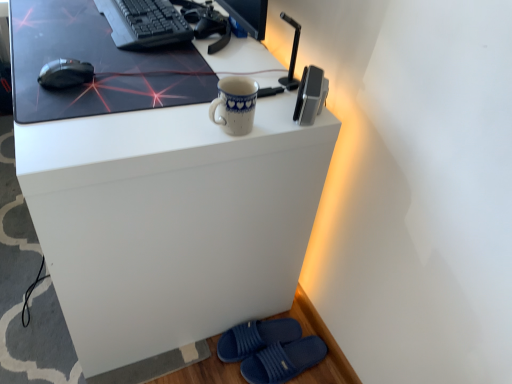
Identify the location of blue fabric slippers at lower right, which ranks as the 1th footwear in top-to-bottom order. The image size is (512, 384). (256, 337).

How much space does blue fabric slippers at lower right, which ranks as the 1th footwear in top-to-bottom order, occupy horizontally?

blue fabric slippers at lower right, which ranks as the 1th footwear in top-to-bottom order, is 12.31 inches in width.

What are the coordinates of `black matte keyboard at upper left` in the screenshot? It's located at (144, 23).

What is the approximate height of black matte mouse at left?

black matte mouse at left is 1.76 inches in height.

Describe the element at coordinates (95, 65) in the screenshot. The image size is (512, 384). I see `matte black mousepad at upper center` at that location.

This screenshot has width=512, height=384. Find the location of `satin silver speaker at upper right`. satin silver speaker at upper right is located at coordinates (310, 95).

From a real-world perspective, is blue porcelain mug at upper center physically above blue rubber slippers at lower right, which is the 1th footwear in bottom-to-top order?

Indeed, from a real-world perspective, blue porcelain mug at upper center stands above blue rubber slippers at lower right, which is the 1th footwear in bottom-to-top order.

This screenshot has width=512, height=384. Find the location of `mug located above the blue rubber slippers at lower right, marked as the second footwear in a top-to-bottom arrangement (from the image's perspective)`. mug located above the blue rubber slippers at lower right, marked as the second footwear in a top-to-bottom arrangement (from the image's perspective) is located at coordinates (234, 105).

Is blue porcelain mug at upper center positioned beyond the bounds of blue rubber slippers at lower right, which is the 1th footwear in bottom-to-top order?

Yes, blue porcelain mug at upper center is located beyond the bounds of blue rubber slippers at lower right, which is the 1th footwear in bottom-to-top order.

Is blue porcelain mug at upper center wider than blue rubber slippers at lower right, marked as the second footwear in a top-to-bottom arrangement?

No.

From the image's perspective, between blue rubber slippers at lower right, which is the 1th footwear in bottom-to-top order, and white glossy desk at center, which one is located above?

white glossy desk at center.

Is white glossy desk at center completely or partially inside blue rubber slippers at lower right, which is the 1th footwear in bottom-to-top order?

Actually, white glossy desk at center is outside blue rubber slippers at lower right, which is the 1th footwear in bottom-to-top order.

From a real-world perspective, is blue rubber slippers at lower right, which is the 1th footwear in bottom-to-top order, over white glossy desk at center?

No, from a real-world perspective, blue rubber slippers at lower right, which is the 1th footwear in bottom-to-top order, is not on top of white glossy desk at center.

From the image's perspective, is satin silver speaker at upper right below black matte mouse at left?

Indeed, from the image's perspective, satin silver speaker at upper right is shown beneath black matte mouse at left.

Measure the distance between satin silver speaker at upper right and black matte mouse at left.

satin silver speaker at upper right is 49.60 centimeters away from black matte mouse at left.

In terms of width, does satin silver speaker at upper right look wider or thinner when compared to black matte mouse at left?

Clearly, satin silver speaker at upper right has less width compared to black matte mouse at left.

Is satin silver speaker at upper right taller than black matte mouse at left?

Correct, satin silver speaker at upper right is much taller as black matte mouse at left.

Is point (311, 95) closer or farther from the camera than point (110, 80)?

Point (311, 95).

Between satin silver speaker at upper right and matte black mousepad at upper center, which one is positioned in front?

matte black mousepad at upper center.

Looking at the image, does satin silver speaker at upper right seem bigger or smaller compared to matte black mousepad at upper center?

In the image, satin silver speaker at upper right appears to be smaller than matte black mousepad at upper center.

Can you see satin silver speaker at upper right touching matte black mousepad at upper center?

They are not placed beside each other.

From the image's perspective, relative to blue rubber slippers at lower right, which is the 1th footwear in bottom-to-top order, is black matte keyboard at upper left above or below?

Based on their image positions, black matte keyboard at upper left is located above blue rubber slippers at lower right, which is the 1th footwear in bottom-to-top order.

Is point (132, 7) closer or farther from the camera than point (286, 380)?

Point (132, 7) is closer to the camera than point (286, 380).

Locate an element on the screen. footwear that is the 2nd one when counting downward from the black matte keyboard at upper left (from the image's perspective) is located at coordinates (283, 360).

From a real-world perspective, is matte black mousepad at upper center located beneath white glossy desk at center?

No, from a real-world perspective, matte black mousepad at upper center is not beneath white glossy desk at center.

From the image's perspective, would you say matte black mousepad at upper center is positioned over white glossy desk at center?

Yes, from the image's perspective, matte black mousepad at upper center is over white glossy desk at center.

Which of these two, matte black mousepad at upper center or white glossy desk at center, is wider?

With larger width is white glossy desk at center.

Looking at this image, can you confirm if matte black mousepad at upper center is taller than white glossy desk at center?

Incorrect, the height of matte black mousepad at upper center is not larger of that of white glossy desk at center.

From the image's perspective, between blue porcelain mug at upper center and black matte mouse at left, which one is located above?

black matte mouse at left.

Which of these two, blue porcelain mug at upper center or black matte mouse at left, is wider?

Wider between the two is black matte mouse at left.

Is blue porcelain mug at upper center to the left or to the right of black matte mouse at left in the image?

blue porcelain mug at upper center is positioned on black matte mouse at left's right side.

Is blue porcelain mug at upper center not within black matte mouse at left?

Yes, blue porcelain mug at upper center is not within black matte mouse at left.

From the image's perspective, count 2nd footwears downward from the blue porcelain mug at upper center and point to it. Please provide its 2D coordinates.

[(283, 360)]

Image resolution: width=512 pixels, height=384 pixels. Find the location of `desk positioned vertically above the blue rubber slippers at lower right, which is the 1th footwear in bottom-to-top order (from a real-world perspective)`. desk positioned vertically above the blue rubber slippers at lower right, which is the 1th footwear in bottom-to-top order (from a real-world perspective) is located at coordinates (170, 221).

Based on their spatial positions, is black matte keyboard at upper left or satin silver speaker at upper right closer to matte black mousepad at upper center?

Among the two, black matte keyboard at upper left is located nearer to matte black mousepad at upper center.

Considering their positions, is blue rubber slippers at lower right, marked as the second footwear in a top-to-bottom arrangement, positioned closer to blue fabric slippers at lower right, which ranks as the 1th footwear in top-to-bottom order, than white glossy desk at center?

Based on the image, blue rubber slippers at lower right, marked as the second footwear in a top-to-bottom arrangement, appears to be nearer to blue fabric slippers at lower right, which ranks as the 1th footwear in top-to-bottom order.

Which object lies further to the anchor point matte black mousepad at upper center, blue rubber slippers at lower right, marked as the second footwear in a top-to-bottom arrangement, or black matte keyboard at upper left?

Among the two, blue rubber slippers at lower right, marked as the second footwear in a top-to-bottom arrangement, is located further to matte black mousepad at upper center.

Considering their positions, is matte black mousepad at upper center positioned closer to satin silver speaker at upper right than white glossy desk at center?

white glossy desk at center is closer to satin silver speaker at upper right.

Looking at the image, which one is located further to blue fabric slippers at lower right, which ranks as the 1th footwear in top-to-bottom order, satin silver speaker at upper right or blue rubber slippers at lower right, which is the 1th footwear in bottom-to-top order?

satin silver speaker at upper right lies further to blue fabric slippers at lower right, which ranks as the 1th footwear in top-to-bottom order, than the other object.

Estimate the real-world distances between objects in this image. Which object is closer to black matte keyboard at upper left, black matte mouse at left or satin silver speaker at upper right?

black matte mouse at left is positioned closer to the anchor black matte keyboard at upper left.

When comparing their distances from blue porcelain mug at upper center, does blue fabric slippers at lower right, which ranks as the 1th footwear in top-to-bottom order, or white glossy desk at center seem further?

blue fabric slippers at lower right, which ranks as the 1th footwear in top-to-bottom order, is positioned further to the anchor blue porcelain mug at upper center.

Looking at this image, based on their spatial positions, is black matte keyboard at upper left or matte black mousepad at upper center further from blue fabric slippers at lower right, which ranks as the second footwear in bottom-to-top order?

black matte keyboard at upper left is further to blue fabric slippers at lower right, which ranks as the second footwear in bottom-to-top order.

Locate an element on the screen. The image size is (512, 384). desktop between white glossy desk at center and black matte mouse at left in the front-back direction is located at coordinates (95, 65).

Identify the location of gadget between black matte keyboard at upper left and blue fabric slippers at lower right, which ranks as the second footwear in bottom-to-top order, in the vertical direction. (310, 95).

The height and width of the screenshot is (384, 512). I want to click on mug located between white glossy desk at center and satin silver speaker at upper right in the left-right direction, so click(x=234, y=105).

This screenshot has height=384, width=512. Identify the location of computer keyboard between white glossy desk at center and satin silver speaker at upper right from left to right. (144, 23).